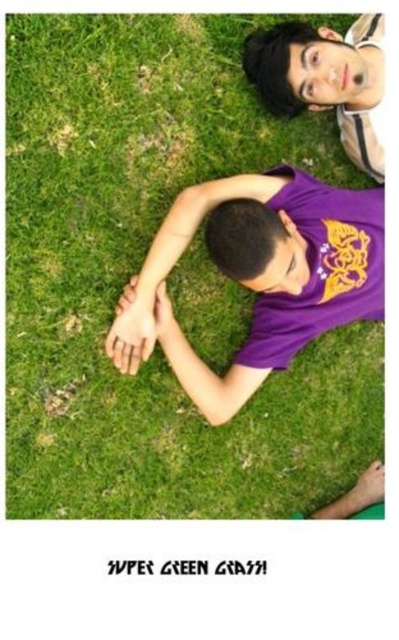
The image size is (399, 640). In order to click on purple matte shirt at center in this screenshot , I will do `click(268, 278)`.

Does purple matte shirt at center have a larger size compared to smooth skin hand at center?

Yes.

Which is in front, point (353, 218) or point (118, 324)?

Positioned in front is point (118, 324).

Where is `purple matte shirt at center`? This screenshot has height=640, width=399. purple matte shirt at center is located at coordinates (268, 278).

The image size is (399, 640). I want to click on matte purple shirt at upper center, so click(x=325, y=77).

Describe the element at coordinates (325, 77) in the screenshot. I see `matte purple shirt at upper center` at that location.

Where is `matte purple shirt at upper center`? This screenshot has height=640, width=399. matte purple shirt at upper center is located at coordinates (325, 77).

Which of these two, green grass at upper center or purple matte shirt at center, stands taller?

Standing taller between the two is green grass at upper center.

Can you confirm if green grass at upper center is bigger than purple matte shirt at center?

Yes.

Describe the element at coordinates (138, 268) in the screenshot. I see `green grass at upper center` at that location.

You are a GUI agent. You are given a task and a screenshot of the screen. Output one action in this format:
    pyautogui.click(x=<x>, y=<y>)
    Task: Click on the green grass at upper center
    The width and height of the screenshot is (399, 640).
    Given the screenshot: What is the action you would take?
    pyautogui.click(x=138, y=268)